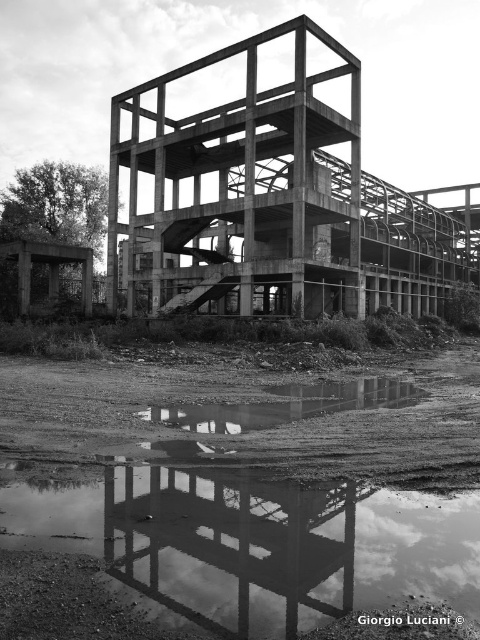
Question: Which point appears closest to the camera in this image?

Choices:
 (A) (189, 115)
 (B) (223, 604)
 (C) (116, 538)

Answer: (B)

Question: Which of the following is the farthest from the observer?

Choices:
 (A) (170, 246)
 (B) (273, 486)

Answer: (A)

Question: Is concrete/cement structure at center positioned before reflective glass structure at center?

Choices:
 (A) yes
 (B) no

Answer: (B)

Question: Which of these objects is positioned farthest from the concrete/cement structure at center?

Choices:
 (A) reflective glass structure at center
 (B) transparent water at lower center

Answer: (A)

Question: Does transparent water at lower center have a lesser width compared to concrete/cement structure at center?

Choices:
 (A) no
 (B) yes

Answer: (B)

Question: Can you confirm if transparent water at lower center is wider than concrete/cement structure at center?

Choices:
 (A) no
 (B) yes

Answer: (A)